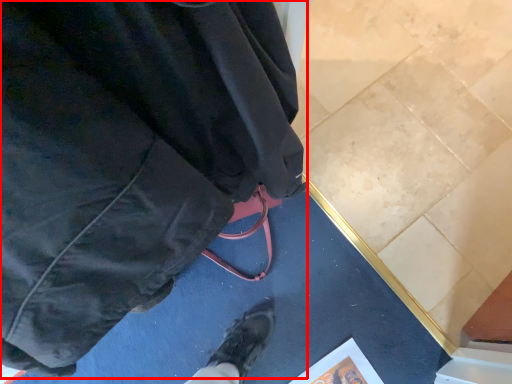
Question: Observing the image, what is the correct spatial positioning of jacket (annotated by the red box) in reference to paperback book?

Choices:
 (A) left
 (B) right

Answer: (A)